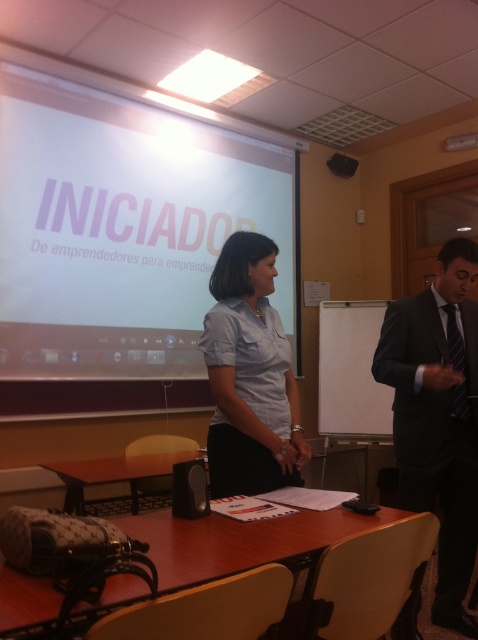
You are organizing a presentation and need to place a large poster on the wall next to the black suit at right and the brown wooden table at lower center. Which object should you consider in terms of size when determining where to place the poster?

The black suit at right is bigger than the brown wooden table at lower center, so you should consider the size of the black suit at right to determine the appropriate placement for the poster.

You are an attendee at the presentation and want to hand a document to the speaker. The black suit at right is blocking your view of the brown wooden table at lower center. Can you reach the table without moving the suit?

The black suit at right is positioned over the brown wooden table at lower center, so you cannot reach the table without moving the suit.